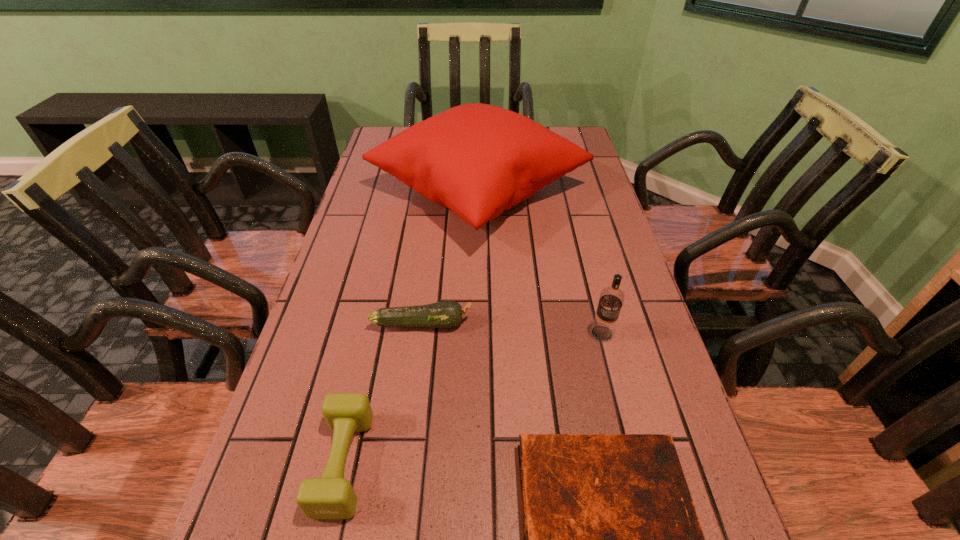
The image size is (960, 540). In the image, there is a desktop. What are the coordinates of `vacant space at the far right corner` in the screenshot? It's located at (579, 134).

Identify the location of vacant area that lies between the fourth tallest object and the second tallest object. (512, 328).

The height and width of the screenshot is (540, 960). Identify the location of vacant area that lies between the third shortest object and the fourth tallest object. (383, 393).

This screenshot has width=960, height=540. I want to click on blank region between the fourth shortest object and the farthest object, so [x=540, y=261].

The image size is (960, 540). I want to click on vacant area that lies between the cushion and the second shortest object, so [450, 256].

Point out which object is positioned as the third nearest to the zucchini. Please provide its 2D coordinates. Your answer should be formatted as a tuple, i.e. [(x, y)], where the tuple contains the x and y coordinates of a point satisfying the conditions above.

[(611, 299)]

The image size is (960, 540). I want to click on object that can be found as the closest to the second tallest object, so click(476, 159).

In order to click on vacant area in the image that satisfies the following two spatial constraints: 1. on the front side of the farthest object; 2. at the blossom end of the second shortest object in this screenshot , I will do `click(477, 323)`.